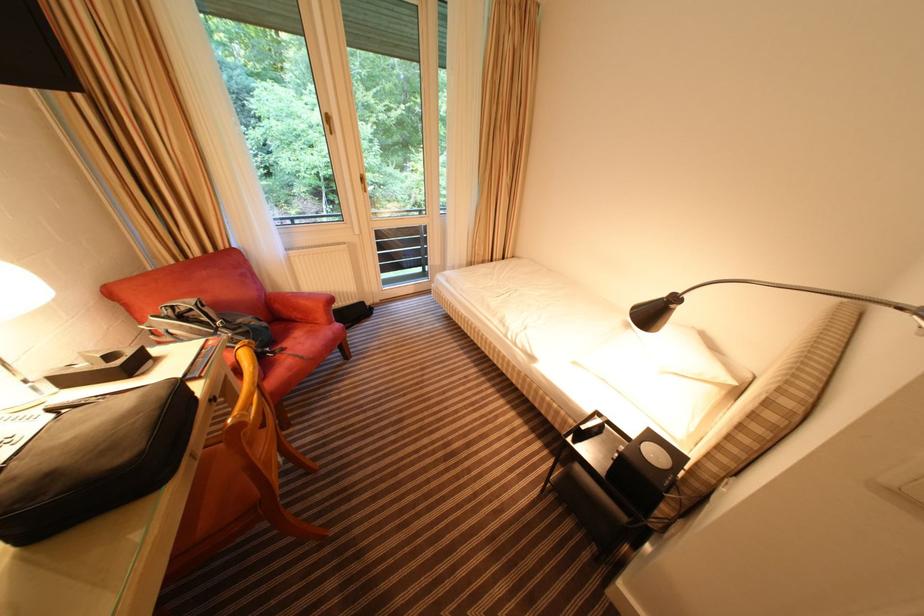
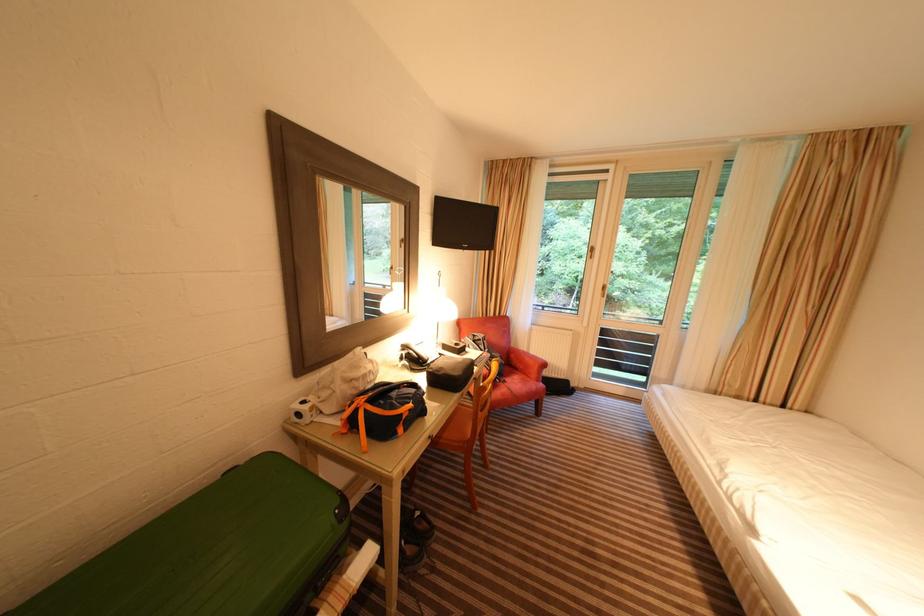
Question: The camera is either moving clockwise (left) or counter-clockwise (right) around the object. The first image is from the beginning of the video and the second image is from the end. Is the camera moving left or right when shooting the video?

Choices:
 (A) Left
 (B) Right

Answer: (B)